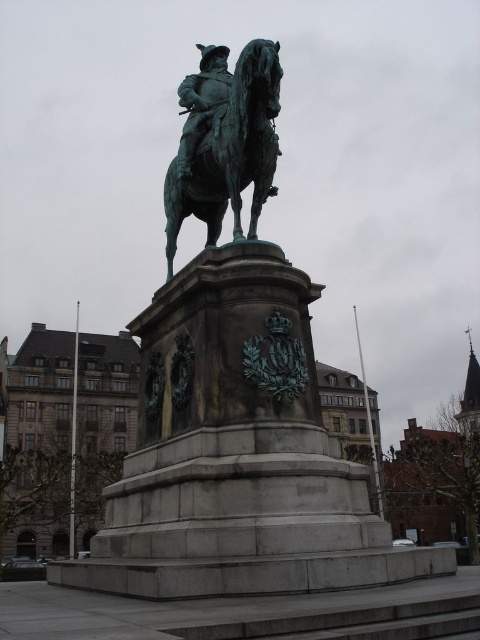
Looking at this image, you are standing in the public square and want to take a photo of the bronze statue at center. If you are currently at position coordinates, can you estimate whether you are closer to the statue or farther away?

The bronze statue at center is located at point coordinates, so you need to compare your current position coordinates with the statue coordinates to determine the distance. Without knowing your exact location, it is impossible to say if you are closer or farther away.